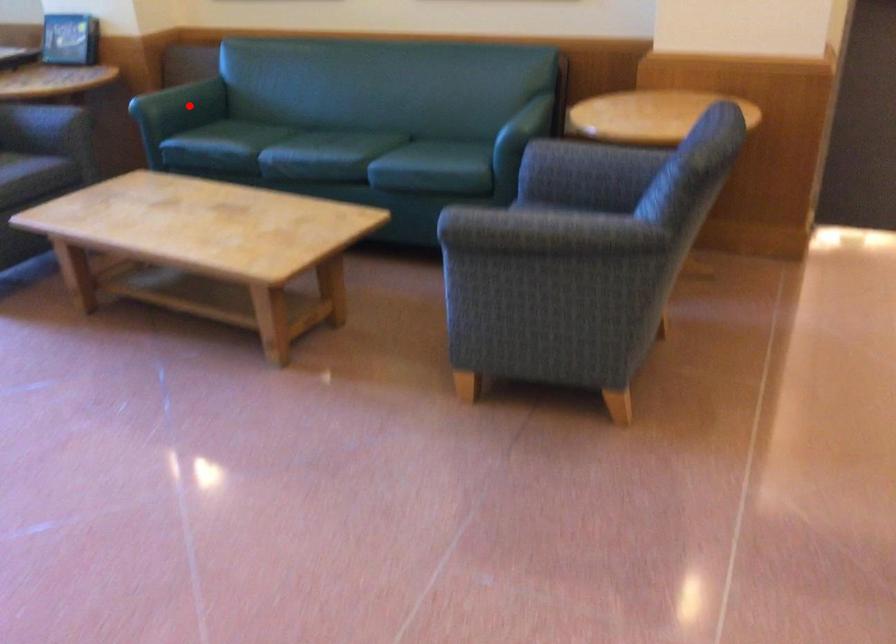
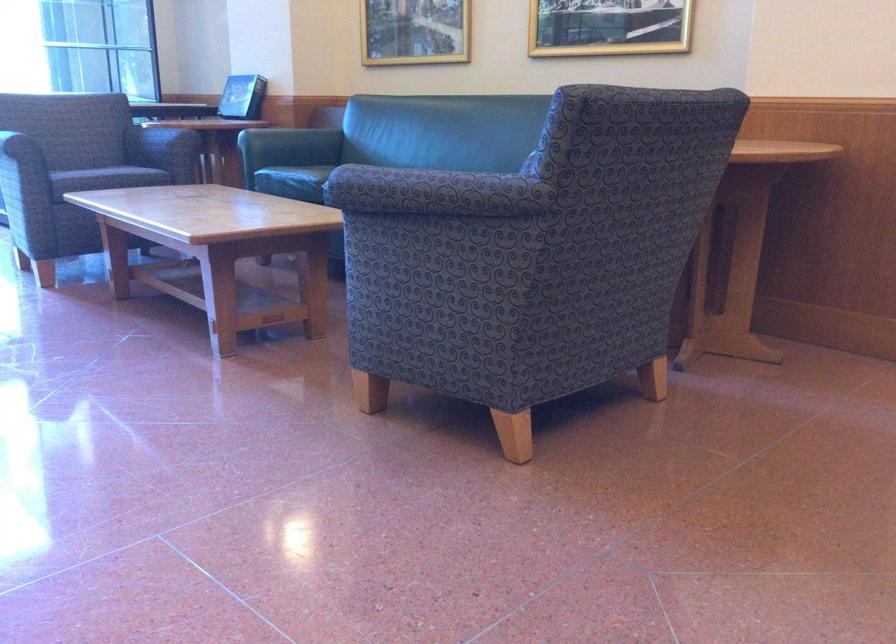
Where in the second image is the point corresponding to the highlighted location from the first image?

(290, 145)